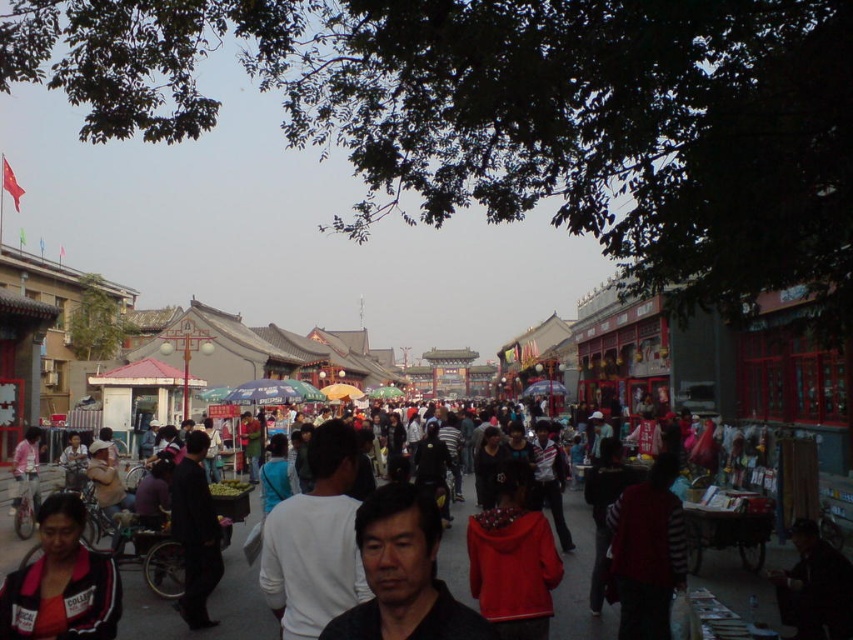
Between striped sweater at center and matte pink shirt at lower left, which one has more height?

Standing taller between the two is striped sweater at center.

Who is lower down, striped sweater at center or matte pink shirt at lower left?

matte pink shirt at lower left is lower down.

Describe the element at coordinates (647, 552) in the screenshot. The width and height of the screenshot is (853, 640). I see `striped sweater at center` at that location.

Where is `striped sweater at center`? striped sweater at center is located at coordinates (647, 552).

Does matte black jacket at lower left have a smaller size compared to striped sweater at center?

Actually, matte black jacket at lower left might be larger than striped sweater at center.

Measure the distance from matte black jacket at lower left to striped sweater at center.

matte black jacket at lower left is 19.50 meters from striped sweater at center.

Is point (112, 632) farther from camera compared to point (665, 544)?

No, it is in front of (665, 544).

Locate an element on the screen. matte black jacket at lower left is located at coordinates (61, 580).

Consider the image. Is dark gray shirt at center bigger than matte pink shirt at lower left?

Yes, dark gray shirt at center is bigger than matte pink shirt at lower left.

Is dark gray shirt at center taller than matte pink shirt at lower left?

Correct, dark gray shirt at center is much taller as matte pink shirt at lower left.

The height and width of the screenshot is (640, 853). What do you see at coordinates (403, 573) in the screenshot?
I see `dark gray shirt at center` at bounding box center [403, 573].

I want to click on dark gray shirt at center, so click(x=403, y=573).